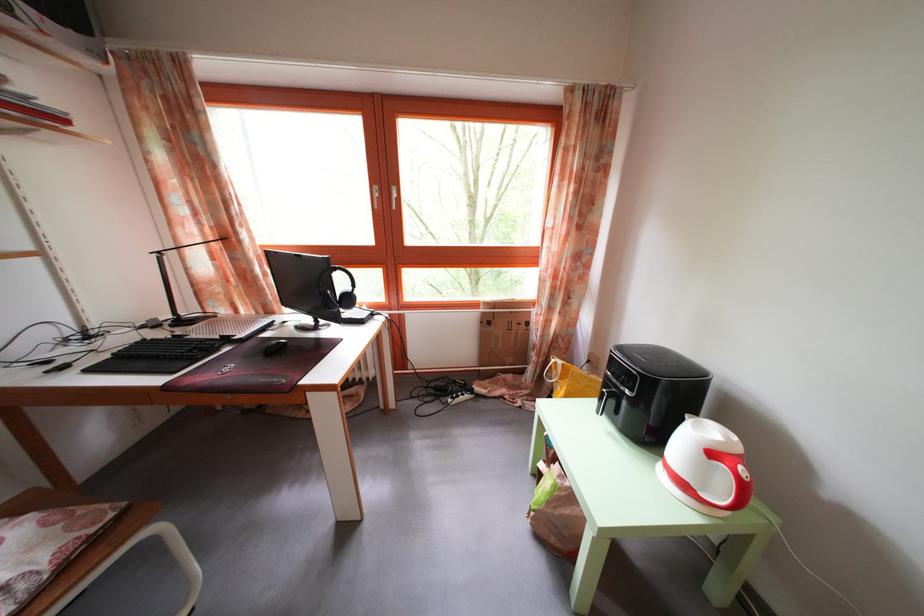
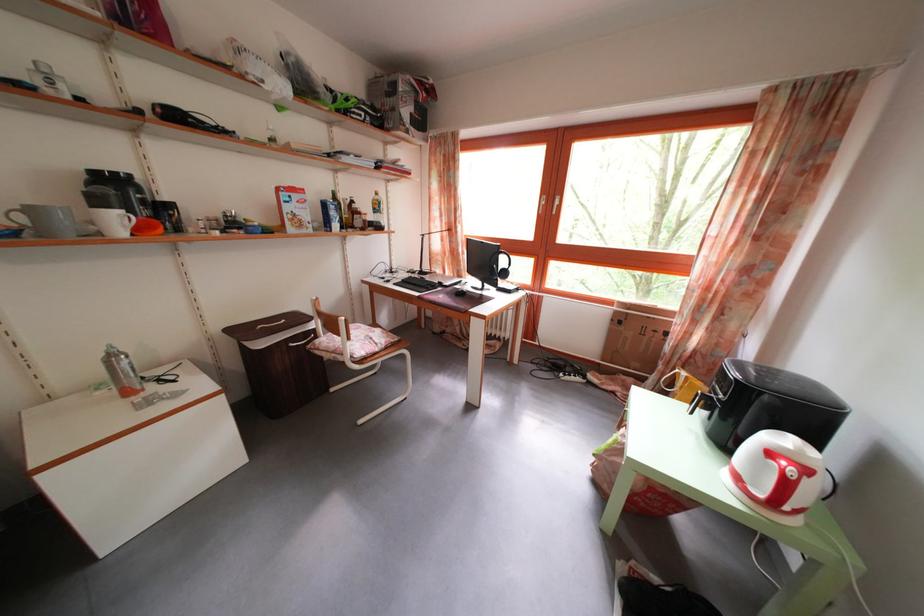
In the second image, find the point that corresponds to (x=249, y=347) in the first image.

(454, 294)